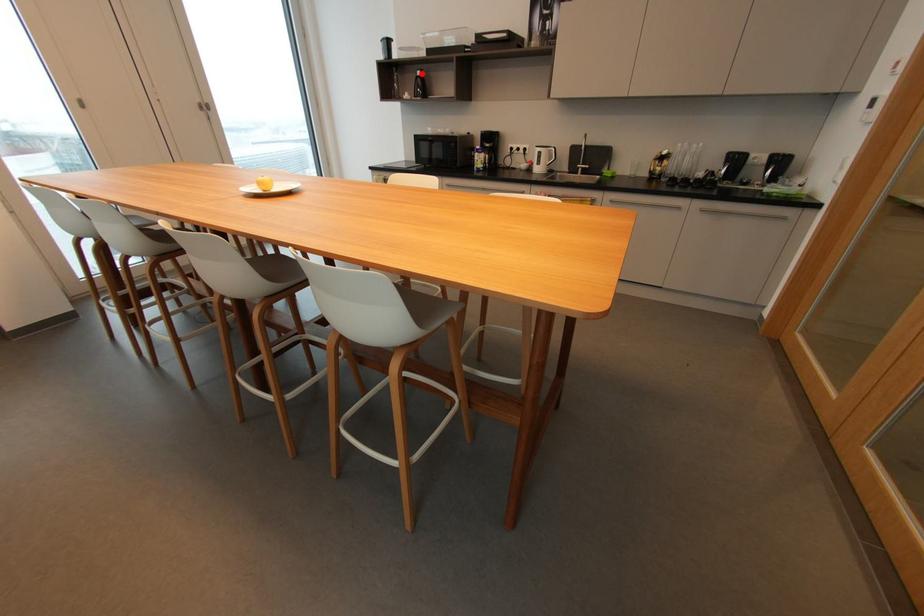
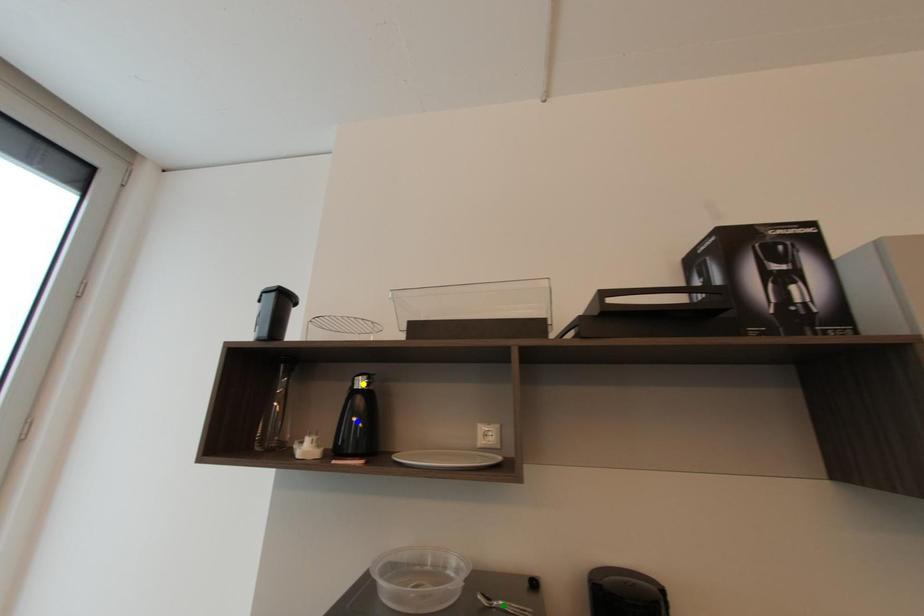
Question: I am providing you with two images of the same scene from different viewpoints. A red point is marked on the first image. You are given multiple points on the second image. Which point in image 2 represents the same 3d spot as the red point in image 1?

Choices:
 (A) yellow point
 (B) green point
 (C) blue point

Answer: (A)